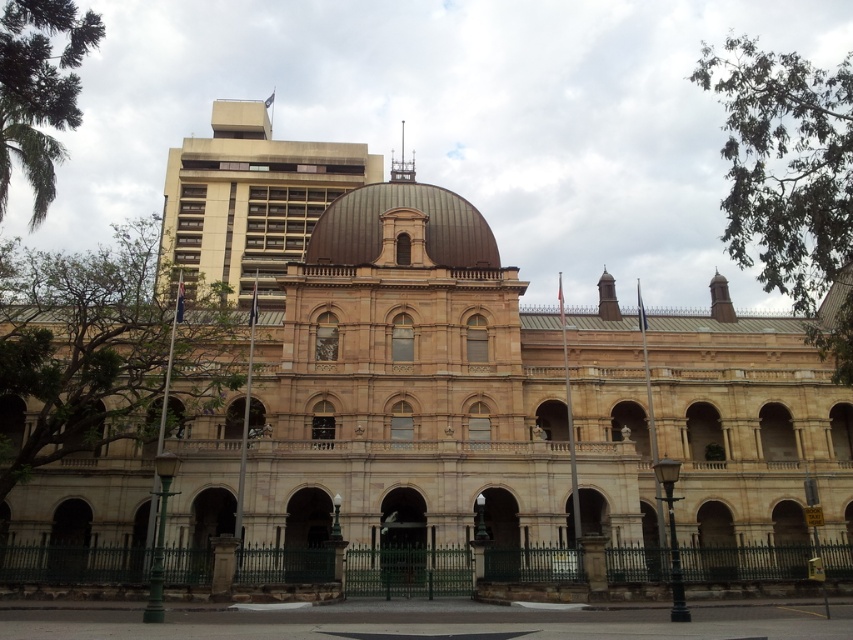
Can you confirm if beige stone dome at upper center is shorter than brown metallic dome at center?

Incorrect, beige stone dome at upper center's height does not fall short of brown metallic dome at center's.

Is point (235, 221) farther from viewer compared to point (354, 189)?

Yes, it is.

Locate an element on the screen. This screenshot has width=853, height=640. beige stone dome at upper center is located at coordinates (251, 198).